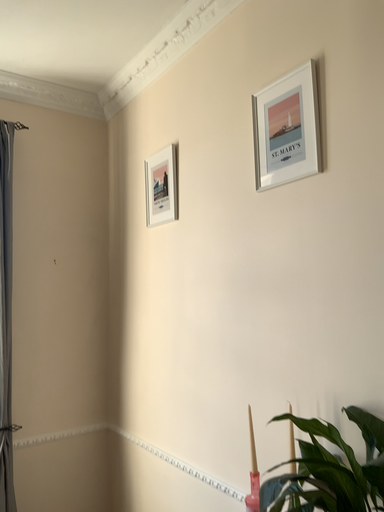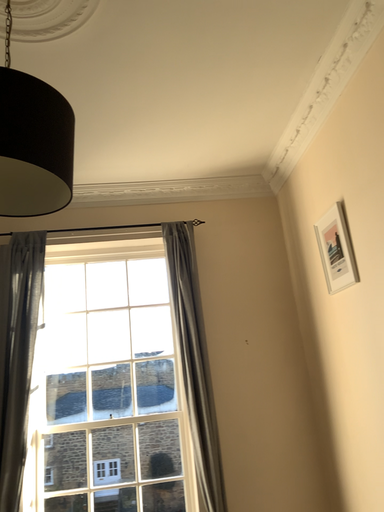
Question: How did the camera likely rotate when shooting the video?

Choices:
 (A) rotated left
 (B) rotated right

Answer: (A)